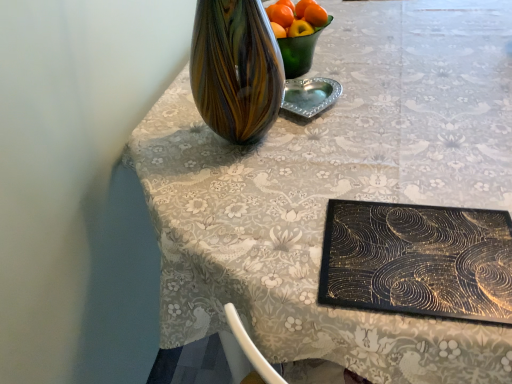
Describe the element at coordinates (310, 95) in the screenshot. I see `silver metallic heart-shaped tray at center` at that location.

You are a GUI agent. You are given a task and a screenshot of the screen. Output one action in this format:
    pyautogui.click(x=<x>, y=<y>)
    Task: Click on the silver metallic heart-shaped tray at center
    
    Given the screenshot: What is the action you would take?
    pyautogui.click(x=310, y=95)

What is the approximate height of orange matte at upper center?

orange matte at upper center is 5.44 centimeters in height.

Where is `orange matte at upper center`? Image resolution: width=512 pixels, height=384 pixels. orange matte at upper center is located at coordinates (280, 15).

Describe the element at coordinates (280, 15) in the screenshot. Image resolution: width=512 pixels, height=384 pixels. I see `orange matte at upper center` at that location.

You are a GUI agent. You are given a task and a screenshot of the screen. Output one action in this format:
    pyautogui.click(x=<x>, y=<y>)
    Task: Click on the silver metallic heart-shaped tray at center
    This screenshot has width=512, height=384.
    Given the screenshot: What is the action you would take?
    pyautogui.click(x=310, y=95)

Which is more to the right, silver metallic heart-shaped tray at center or orange matte at upper center?

Positioned to the right is silver metallic heart-shaped tray at center.

Considering the positions of objects silver metallic heart-shaped tray at center and orange matte at upper center in the image provided, who is behind, silver metallic heart-shaped tray at center or orange matte at upper center?

orange matte at upper center is behind.

Is point (302, 102) positioned in front of point (288, 10)?

Yes, it is in front of point (288, 10).

From the image's perspective, which object appears higher, silver metallic heart-shaped tray at center or orange matte at upper center?

orange matte at upper center.

From a real-world perspective, is silver metallic heart-shaped tray at center physically above orange matte at upper center?

No.

Is silver metallic heart-shaped tray at center thinner than orange matte at upper center?

No.

Who is shorter, silver metallic heart-shaped tray at center or orange matte at upper center?

silver metallic heart-shaped tray at center is shorter.

From the picture: Considering the sizes of objects silver metallic heart-shaped tray at center and orange matte at upper center in the image provided, who is bigger, silver metallic heart-shaped tray at center or orange matte at upper center?

With larger size is silver metallic heart-shaped tray at center.

Is silver metallic heart-shaped tray at center located outside orange matte at upper center?

Yes, silver metallic heart-shaped tray at center is located beyond the bounds of orange matte at upper center.

Can you see silver metallic heart-shaped tray at center touching orange matte at upper center?

No, silver metallic heart-shaped tray at center is not touching orange matte at upper center.

Is silver metallic heart-shaped tray at center turned away from orange matte at upper center?

That's not correct — silver metallic heart-shaped tray at center is not looking away from orange matte at upper center.

How many degrees apart are the facing directions of silver metallic heart-shaped tray at center and orange matte at upper center?

The angle between the facing direction of silver metallic heart-shaped tray at center and the facing direction of orange matte at upper center is 7.42 degrees.

The height and width of the screenshot is (384, 512). I want to click on orange above the silver metallic heart-shaped tray at center (from the image's perspective), so pyautogui.click(x=280, y=15).

Between orange matte at upper center and silver metallic heart-shaped tray at center, which one appears on the left side from the viewer's perspective?

Positioned to the left is orange matte at upper center.

Does orange matte at upper center lie behind silver metallic heart-shaped tray at center?

Yes, it is.

Does point (288, 12) lie in front of point (313, 111)?

No, it is behind (313, 111).

From the image's perspective, is orange matte at upper center beneath silver metallic heart-shaped tray at center?

Actually, orange matte at upper center appears above silver metallic heart-shaped tray at center in the image.

From a real-world perspective, between orange matte at upper center and silver metallic heart-shaped tray at center, who is vertically higher?

In real-world perspective, orange matte at upper center is above.

Looking at this image, in terms of width, does orange matte at upper center look wider or thinner when compared to silver metallic heart-shaped tray at center?

orange matte at upper center is thinner than silver metallic heart-shaped tray at center.

Between orange matte at upper center and silver metallic heart-shaped tray at center, which one has more height?

Standing taller between the two is orange matte at upper center.

Considering the relative sizes of orange matte at upper center and silver metallic heart-shaped tray at center in the image provided, is orange matte at upper center smaller than silver metallic heart-shaped tray at center?

Correct, orange matte at upper center occupies less space than silver metallic heart-shaped tray at center.

In the scene shown: Is orange matte at upper center not inside silver metallic heart-shaped tray at center?

Yes, orange matte at upper center is not within silver metallic heart-shaped tray at center.

From the picture: Is orange matte at upper center far from silver metallic heart-shaped tray at center?

orange matte at upper center is actually quite close to silver metallic heart-shaped tray at center.

Is orange matte at upper center positioned with its back to silver metallic heart-shaped tray at center?

That's not correct — orange matte at upper center is not looking away from silver metallic heart-shaped tray at center.

Locate an element on the screen. The image size is (512, 384). orange above the silver metallic heart-shaped tray at center (from a real-world perspective) is located at coordinates (280, 15).

This screenshot has height=384, width=512. In order to click on tableware in front of the orange matte at upper center in this screenshot , I will do `click(310, 95)`.

At what (x,y) coordinates should I click in order to perform the action: click on orange above the silver metallic heart-shaped tray at center (from the image's perspective). Please return your answer as a coordinate pair (x, y). This screenshot has height=384, width=512. Looking at the image, I should click on (280, 15).